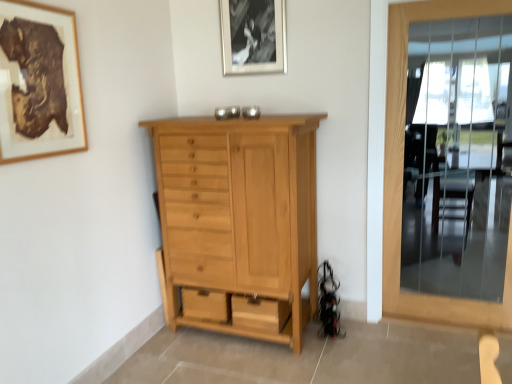
Question: Is wooden picture frame at upper left, the 1th picture frame in the front-to-back sequence, not inside natural wood cabinet at center?

Choices:
 (A) no
 (B) yes

Answer: (B)

Question: From the image's perspective, is wooden picture frame at upper left, the 1th picture frame from the bottom, below natural wood cabinet at center?

Choices:
 (A) no
 (B) yes

Answer: (A)

Question: Is wooden picture frame at upper left, the 1th picture frame in the front-to-back sequence, facing away from natural wood cabinet at center?

Choices:
 (A) no
 (B) yes

Answer: (A)

Question: From a real-world perspective, is wooden picture frame at upper left, which ranks as the first picture frame in left-to-right order, located beneath natural wood cabinet at center?

Choices:
 (A) no
 (B) yes

Answer: (A)

Question: Is the surface of wooden picture frame at upper left, placed as the 2th picture frame when sorted from top to bottom, in direct contact with natural wood cabinet at center?

Choices:
 (A) no
 (B) yes

Answer: (A)

Question: Considering the relative positions of wooden picture frame at upper left, which ranks as the second picture frame in back-to-front order, and natural wood cabinet at center in the image provided, is wooden picture frame at upper left, which ranks as the second picture frame in back-to-front order, to the left of natural wood cabinet at center from the viewer's perspective?

Choices:
 (A) yes
 (B) no

Answer: (A)

Question: Can you confirm if natural wood cabinet at center is wider than wooden picture frame at upper left, the 1th picture frame in the front-to-back sequence?

Choices:
 (A) no
 (B) yes

Answer: (B)

Question: From a real-world perspective, is natural wood cabinet at center located higher than wooden picture frame at upper left, the 1th picture frame in the front-to-back sequence?

Choices:
 (A) no
 (B) yes

Answer: (A)

Question: Does natural wood cabinet at center appear on the left side of wooden picture frame at upper left, which ranks as the first picture frame in left-to-right order?

Choices:
 (A) yes
 (B) no

Answer: (B)

Question: Is wooden picture frame at upper left, arranged as the second picture frame when viewed from the right, inside natural wood cabinet at center?

Choices:
 (A) yes
 (B) no

Answer: (B)

Question: From the image's perspective, is natural wood cabinet at center under wooden picture frame at upper left, arranged as the second picture frame when viewed from the right?

Choices:
 (A) no
 (B) yes

Answer: (B)

Question: Is natural wood cabinet at center positioned beyond the bounds of wooden picture frame at upper left, the 1th picture frame in the front-to-back sequence?

Choices:
 (A) yes
 (B) no

Answer: (A)

Question: From the image's perspective, would you say wooden picture frame at upper left, the 1th picture frame in the front-to-back sequence, is shown under clear glass door at right?

Choices:
 (A) yes
 (B) no

Answer: (B)